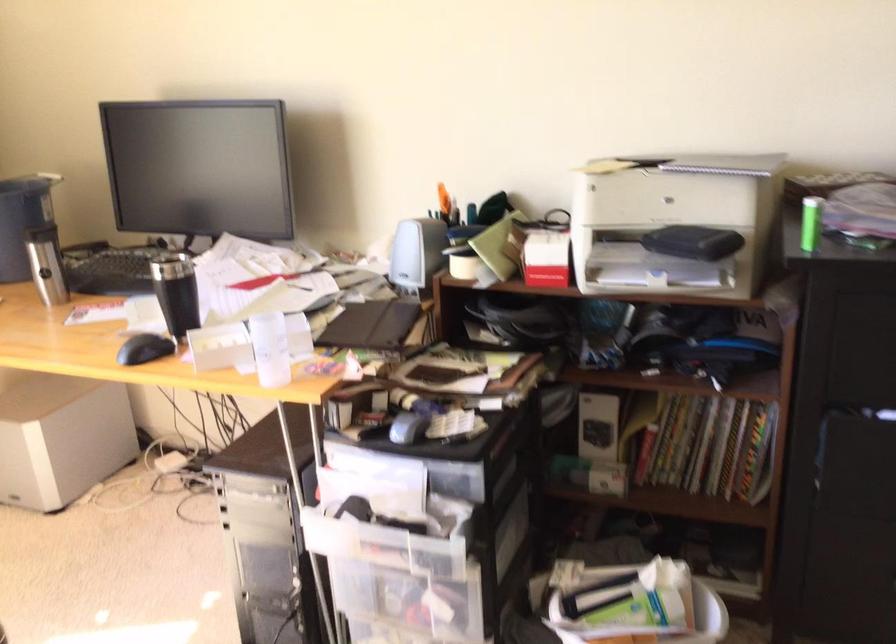
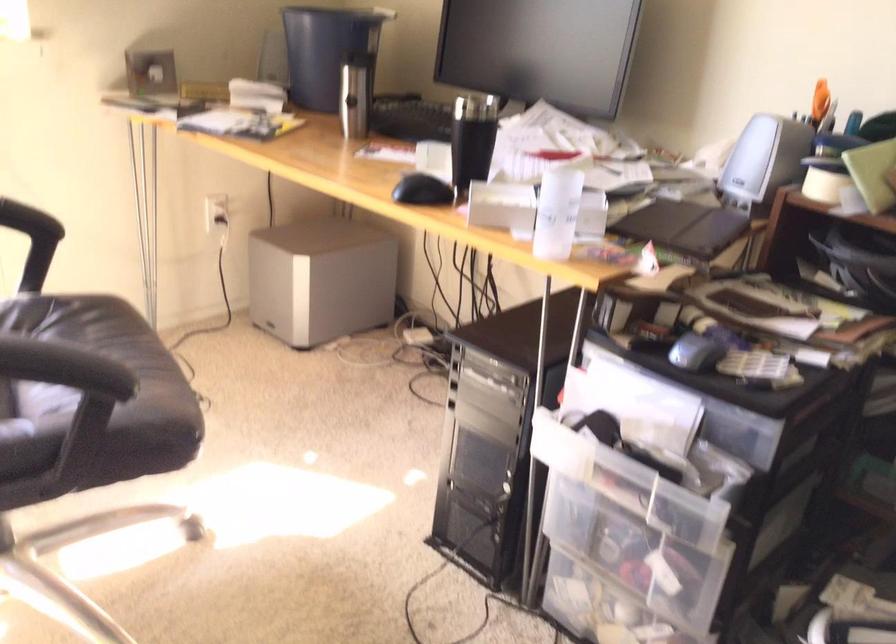
Find the pixel in the second image that matches (181,292) in the first image.

(471, 140)